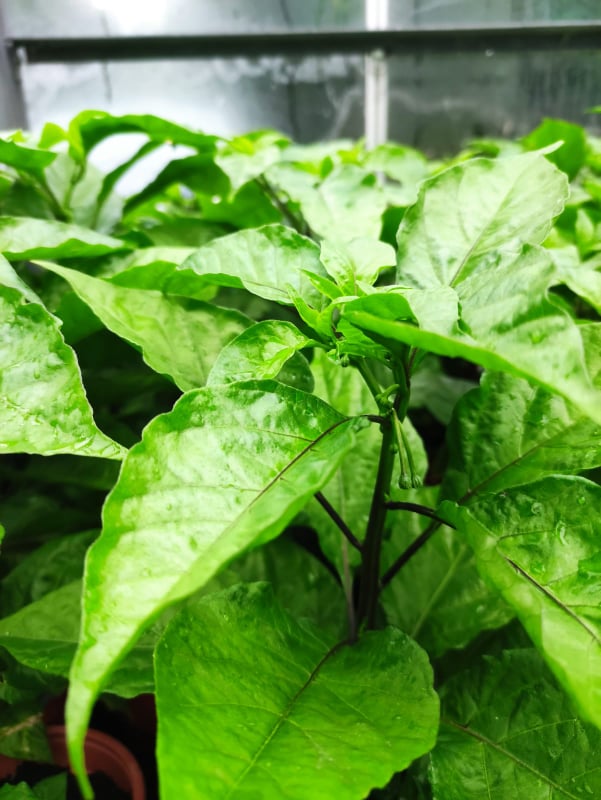
At what (x,y) coordinates should I click in order to perform the action: click on flower pot. Please return your answer as a coordinate pair (x, y). The width and height of the screenshot is (601, 800). Looking at the image, I should click on pos(105,741), pos(145,708).